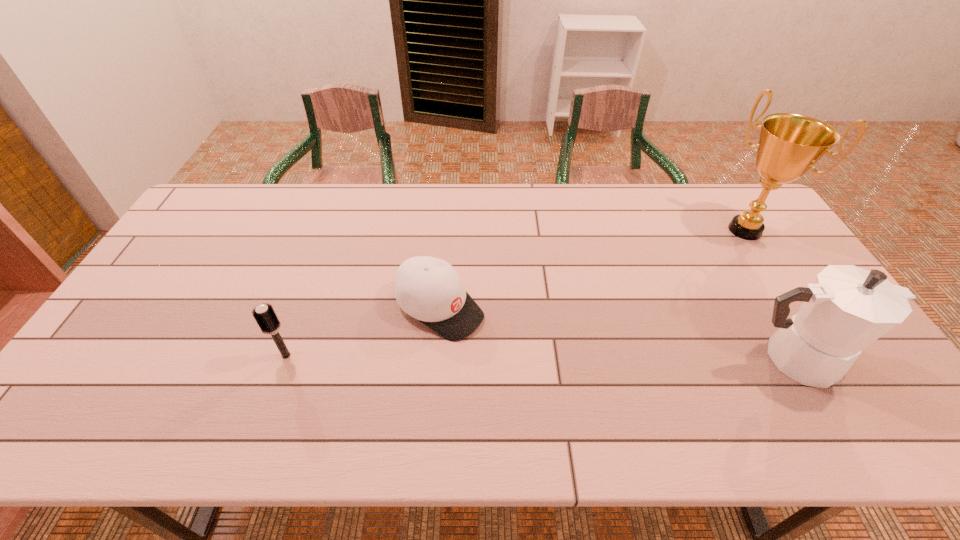
This screenshot has height=540, width=960. Identify the location of vacant space located 0.140m on the front view with handles of the tallest object. (708, 264).

You are a GUI agent. You are given a task and a screenshot of the screen. Output one action in this format:
    pyautogui.click(x=<x>, y=<y>)
    Task: Click on the vacant area situated on the front-facing side of the baseball cap
    This screenshot has width=960, height=540.
    Given the screenshot: What is the action you would take?
    pyautogui.click(x=567, y=391)

Where is `vacant space located on the front-facing side of the baseball cap`? This screenshot has width=960, height=540. vacant space located on the front-facing side of the baseball cap is located at coordinates (578, 399).

You are a GUI agent. You are given a task and a screenshot of the screen. Output one action in this format:
    pyautogui.click(x=<x>, y=<y>)
    Task: Click on the free space located 0.150m on the front-facing side of the baseball cap
    
    Given the screenshot: What is the action you would take?
    pyautogui.click(x=519, y=360)

What are the coordinates of `object situated at the far edge` in the screenshot? It's located at (790, 144).

The width and height of the screenshot is (960, 540). In order to click on object that is positioned at the near edge in this screenshot , I will do `click(847, 308)`.

At what (x,y) coordinates should I click in order to perform the action: click on coffeepot that is at the right edge. Please return your answer as a coordinate pair (x, y). The width and height of the screenshot is (960, 540). Looking at the image, I should click on (847, 308).

Identify the location of award at the right edge. (790, 144).

The width and height of the screenshot is (960, 540). I want to click on object that is positioned at the far right corner, so click(x=790, y=144).

This screenshot has height=540, width=960. I want to click on object located in the near right corner section of the desktop, so click(x=847, y=308).